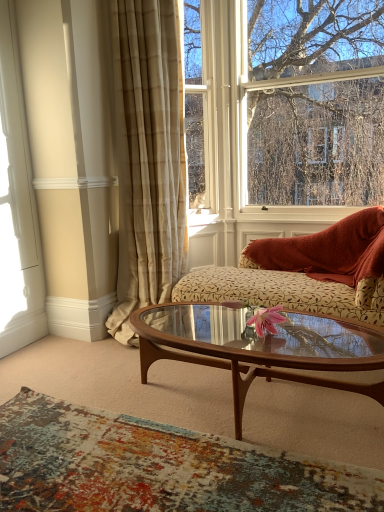
Question: Is the depth of floral-patterned fabric couch at center less than that of beige plaid curtain at center?

Choices:
 (A) no
 (B) yes

Answer: (B)

Question: Is floral-patterned fabric couch at center to the left of beige plaid curtain at center from the viewer's perspective?

Choices:
 (A) yes
 (B) no

Answer: (B)

Question: Can you confirm if floral-patterned fabric couch at center is shorter than beige plaid curtain at center?

Choices:
 (A) yes
 (B) no

Answer: (A)

Question: Is floral-patterned fabric couch at center facing towards beige plaid curtain at center?

Choices:
 (A) yes
 (B) no

Answer: (B)

Question: Is floral-patterned fabric couch at center completely or partially outside of beige plaid curtain at center?

Choices:
 (A) yes
 (B) no

Answer: (A)

Question: From a real-world perspective, is floral-patterned fabric couch at center located higher than beige plaid curtain at center?

Choices:
 (A) no
 (B) yes

Answer: (A)

Question: Is beige plaid curtain at center thinner than floral-patterned fabric couch at center?

Choices:
 (A) yes
 (B) no

Answer: (B)

Question: Is beige plaid curtain at center outside of floral-patterned fabric couch at center?

Choices:
 (A) no
 (B) yes

Answer: (B)

Question: Does beige plaid curtain at center have a larger size compared to floral-patterned fabric couch at center?

Choices:
 (A) no
 (B) yes

Answer: (B)

Question: Considering the relative sizes of beige plaid curtain at center and floral-patterned fabric couch at center in the image provided, is beige plaid curtain at center taller than floral-patterned fabric couch at center?

Choices:
 (A) no
 (B) yes

Answer: (B)

Question: From the image's perspective, would you say beige plaid curtain at center is positioned over floral-patterned fabric couch at center?

Choices:
 (A) yes
 (B) no

Answer: (A)

Question: From a real-world perspective, is beige plaid curtain at center physically below floral-patterned fabric couch at center?

Choices:
 (A) no
 (B) yes

Answer: (A)

Question: From the image's perspective, is beige plaid curtain at center below white wood window frame at left?

Choices:
 (A) no
 (B) yes

Answer: (A)